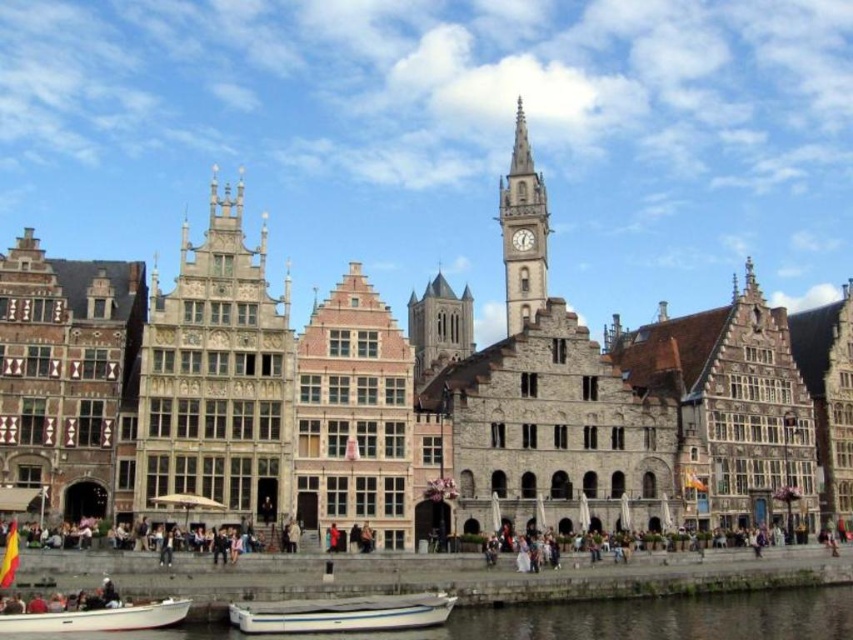
The width and height of the screenshot is (853, 640). What do you see at coordinates (341, 612) in the screenshot? I see `white plastic boat at lower center` at bounding box center [341, 612].

Does white plastic boat at lower center appear under stone tower at center?

Correct, white plastic boat at lower center is located below stone tower at center.

Between point (328, 612) and point (448, 356), which one is positioned behind?

The point (448, 356) is more distant.

Locate an element on the screen. white plastic boat at lower center is located at coordinates (341, 612).

Which is more to the right, white smooth water at lower center or stone tower at center?

Positioned to the right is white smooth water at lower center.

Between white smooth water at lower center and stone tower at center, which one appears on the left side from the viewer's perspective?

stone tower at center

Image resolution: width=853 pixels, height=640 pixels. What do you see at coordinates (592, 620) in the screenshot?
I see `white smooth water at lower center` at bounding box center [592, 620].

This screenshot has width=853, height=640. Identify the location of white smooth water at lower center. (592, 620).

Looking at this image, can you confirm if white plastic boat at lower center is positioned to the left of white matte boat at lower left?

No, white plastic boat at lower center is not to the left of white matte boat at lower left.

Which is below, white plastic boat at lower center or white matte boat at lower left?

white plastic boat at lower center is lower down.

Which is behind, point (276, 611) or point (120, 618)?

The point (276, 611) is more distant.

The width and height of the screenshot is (853, 640). Identify the location of white plastic boat at lower center. pos(341,612).